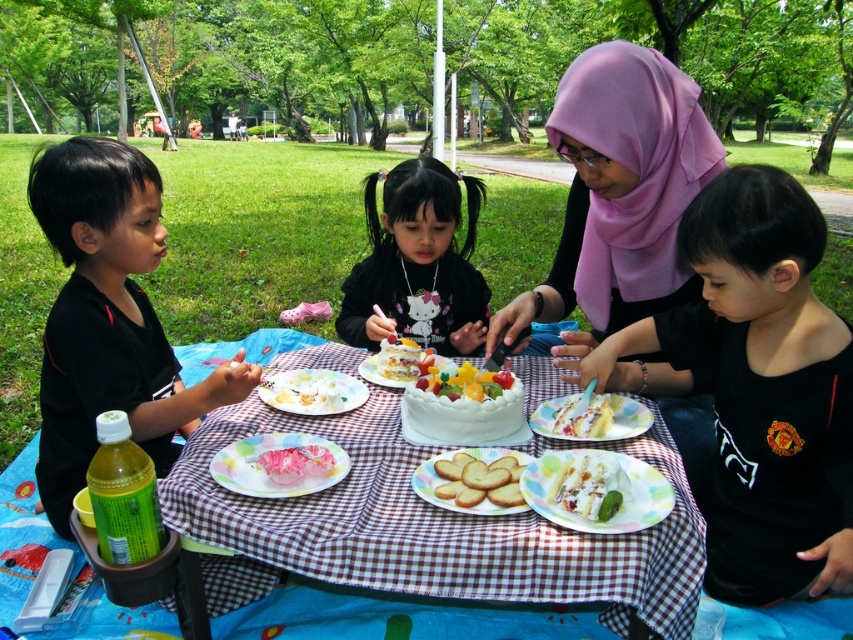
Based on the photo, can you confirm if purple satin hijab at center is shorter than white creamy cake at center?

Incorrect, purple satin hijab at center's height does not fall short of white creamy cake at center's.

Describe the element at coordinates (619, 193) in the screenshot. The image size is (853, 640). I see `purple satin hijab at center` at that location.

This screenshot has height=640, width=853. I want to click on purple satin hijab at center, so click(x=619, y=193).

Can you confirm if black matte shirt at left is positioned to the right of yellow cake at center?

In fact, black matte shirt at left is to the left of yellow cake at center.

Which is behind, point (138, 170) or point (556, 429)?

The point (138, 170) is more distant.

Identify the location of black matte shirt at left. The image size is (853, 640). (108, 317).

Based on the photo, does black matte shirt at lower right appear over black matte shirt at left?

No.

Who is taller, black matte shirt at lower right or black matte shirt at left?

black matte shirt at left is taller.

Is point (780, 579) more distant than point (88, 259)?

No, (780, 579) is closer to viewer.

Locate an element on the screen. The height and width of the screenshot is (640, 853). black matte shirt at lower right is located at coordinates (761, 387).